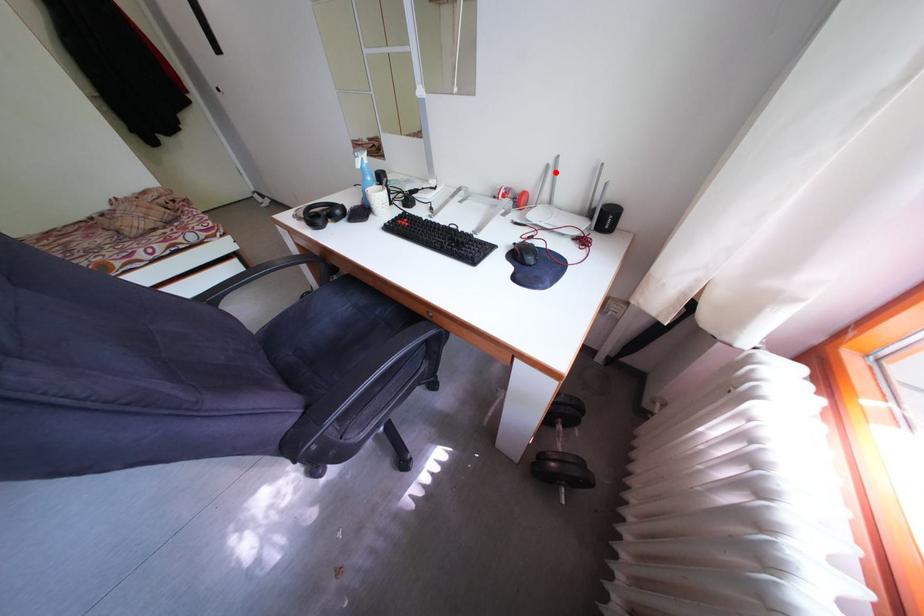
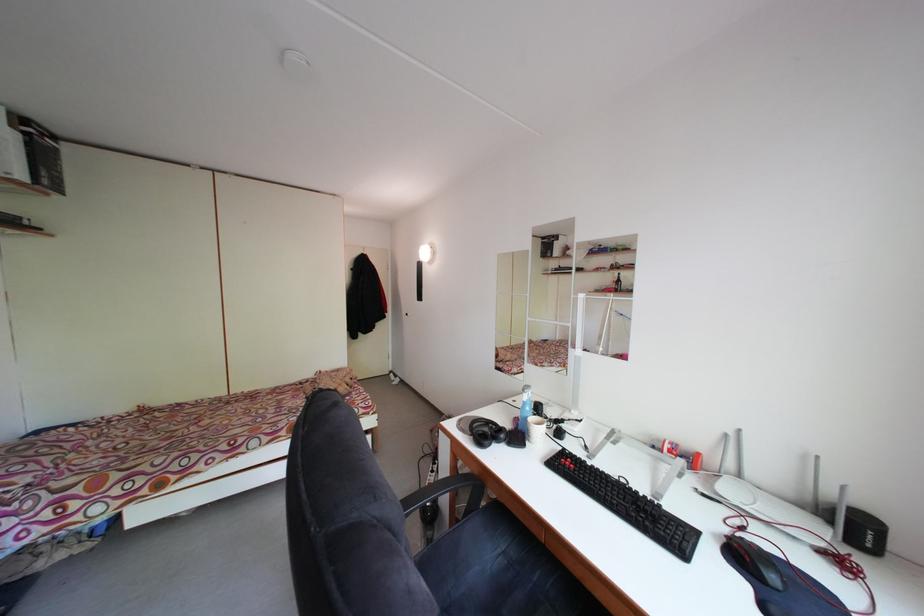
Where in the second image is the point corresponding to the highlighted location from the first image?

(735, 442)